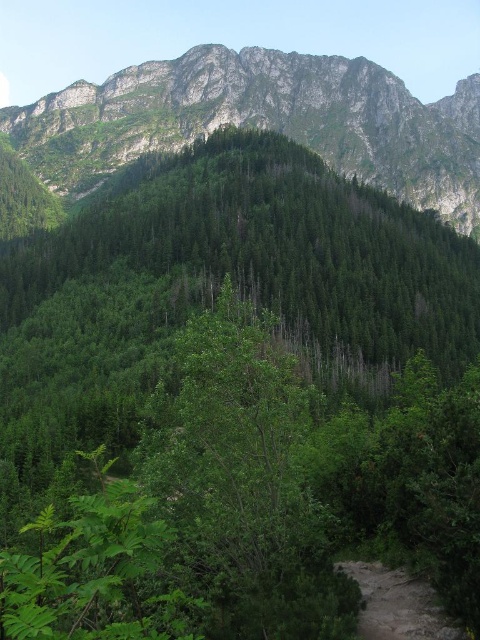
Question: Which point appears farthest from the camera in this image?

Choices:
 (A) (13, 108)
 (B) (376, 586)

Answer: (A)

Question: Does green forested mountain at upper center lie in front of dirt path at lower right?

Choices:
 (A) yes
 (B) no

Answer: (B)

Question: Does green forested mountain at upper center appear over dirt path at lower right?

Choices:
 (A) yes
 (B) no

Answer: (A)

Question: Is green forested mountain at upper center bigger than dirt path at lower right?

Choices:
 (A) no
 (B) yes

Answer: (B)

Question: Among these points, which one is farthest from the camera?

Choices:
 (A) (191, 60)
 (B) (374, 593)

Answer: (A)